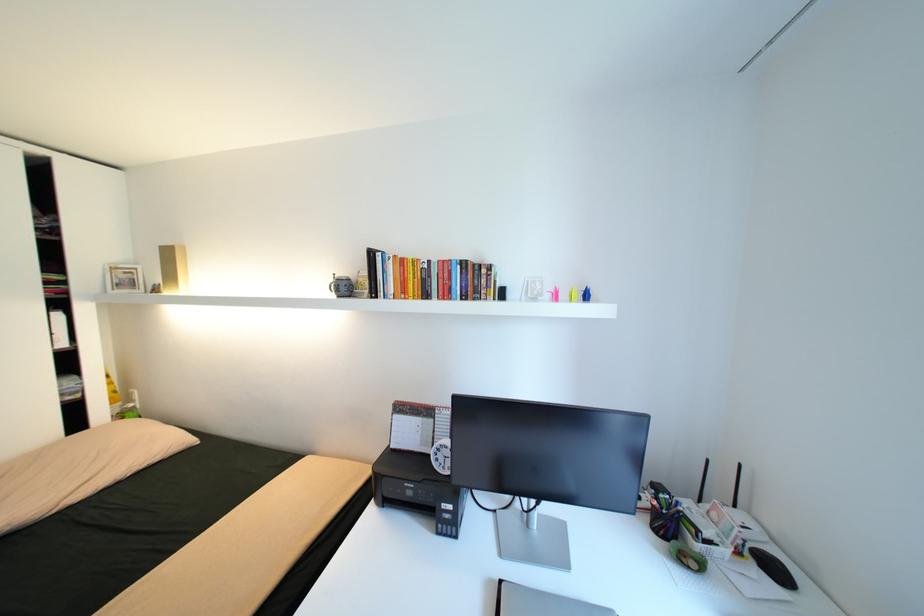
Which object does [341,286] point to?

It corresponds to the small grey teapot in the image.